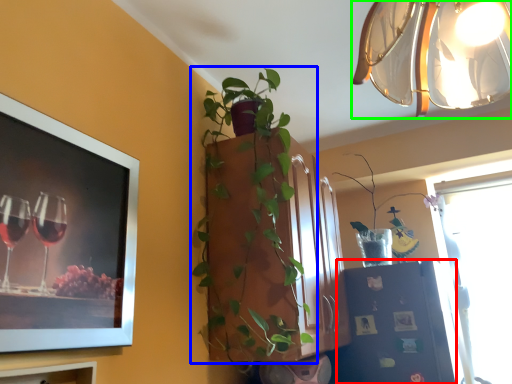
Question: Based on their relative distances, which object is farther from shelf (highlighted by a red box)? Choose from houseplant (highlighted by a blue box) and lamp (highlighted by a green box).

Choices:
 (A) houseplant
 (B) lamp

Answer: (B)